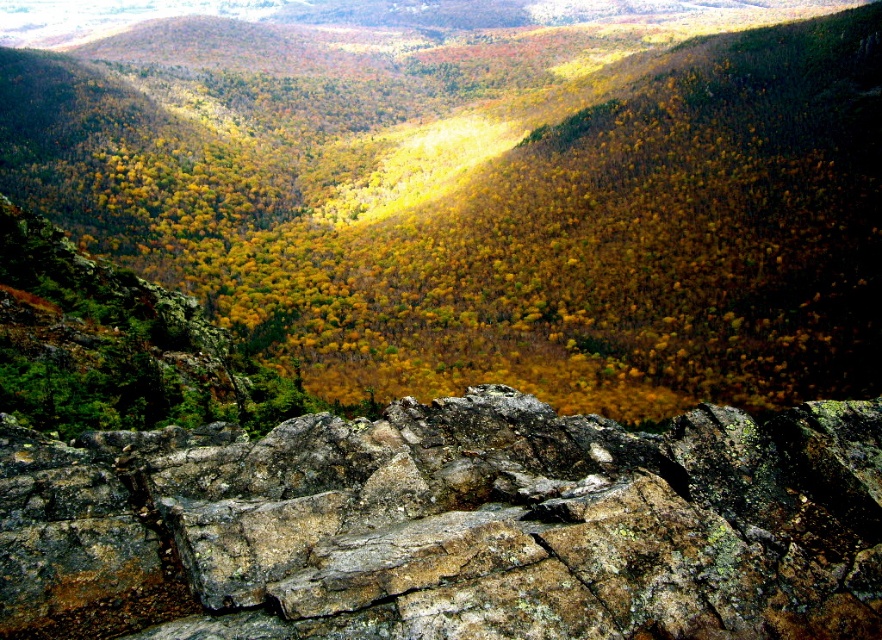
You are a hiker standing at the edge of the valley. You see the rocky terrain at lower center and the rusty rock at bottom. Which one is higher up the slope?

The rocky terrain at lower center is taller than the rusty rock at bottom, so the rocky terrain at lower center is higher up the slope.

You are standing at the origin point in the image, which is the bottom left corner. You want to reach the dense forest in the middle ground. Which direction should you move from the rocky terrain at lower center to get there?

The dense forest in the middle ground is located above the rocky terrain at lower center, so you should move upward from the rocky terrain at lower center to reach it.